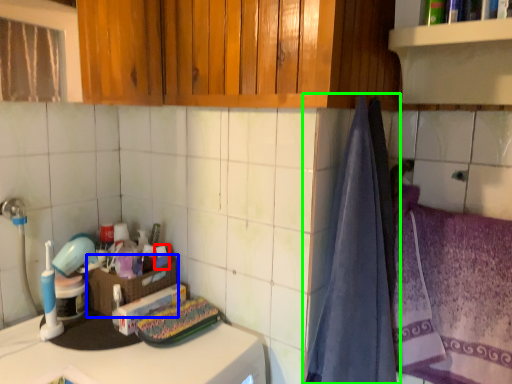
Question: Considering the real-world distances, which object is closest to toiletry (highlighted by a red box)? basket (highlighted by a blue box) or curtain (highlighted by a green box).

Choices:
 (A) basket
 (B) curtain

Answer: (A)